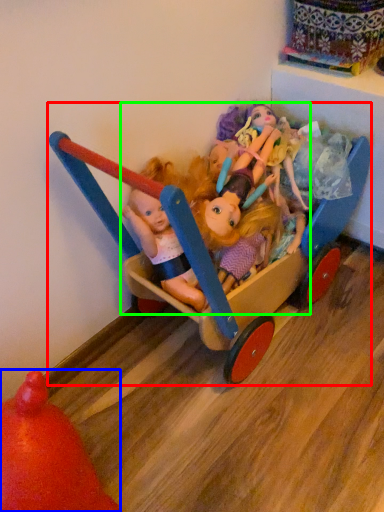
Question: Considering the real-world distances, which object is farthest from toy (highlighted by a red box)? toy (highlighted by a blue box) or doll (highlighted by a green box)?

Choices:
 (A) toy
 (B) doll

Answer: (A)